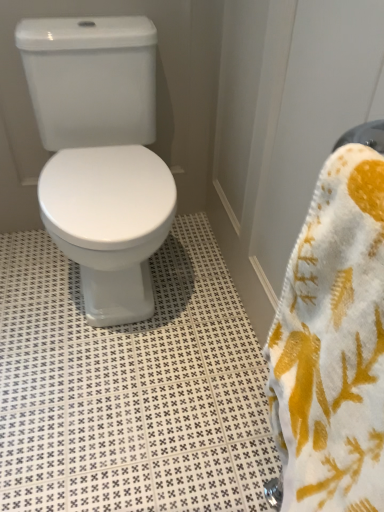
Question: Can you see white textured tile at center touching white soft towel at right?

Choices:
 (A) no
 (B) yes

Answer: (A)

Question: Can you confirm if white textured tile at center is thinner than white soft towel at right?

Choices:
 (A) yes
 (B) no

Answer: (B)

Question: Is white textured tile at center facing away from white soft towel at right?

Choices:
 (A) yes
 (B) no

Answer: (B)

Question: Does white textured tile at center turn towards white soft towel at right?

Choices:
 (A) yes
 (B) no

Answer: (B)

Question: Is white textured tile at center wider than white soft towel at right?

Choices:
 (A) no
 (B) yes

Answer: (B)

Question: Does white textured tile at center have a smaller size compared to white soft towel at right?

Choices:
 (A) yes
 (B) no

Answer: (B)

Question: Can you confirm if white glossy toilet at center is positioned to the right of white textured tile at center?

Choices:
 (A) no
 (B) yes

Answer: (A)

Question: Considering the relative sizes of white glossy toilet at center and white textured tile at center in the image provided, is white glossy toilet at center shorter than white textured tile at center?

Choices:
 (A) yes
 (B) no

Answer: (B)

Question: Is white glossy toilet at center looking in the opposite direction of white textured tile at center?

Choices:
 (A) no
 (B) yes

Answer: (A)

Question: From the image's perspective, would you say white glossy toilet at center is positioned over white textured tile at center?

Choices:
 (A) no
 (B) yes

Answer: (B)

Question: Can you confirm if white glossy toilet at center is positioned to the left of white textured tile at center?

Choices:
 (A) no
 (B) yes

Answer: (B)

Question: Is white textured tile at center completely or partially inside white glossy toilet at center?

Choices:
 (A) yes
 (B) no

Answer: (B)

Question: Is white glossy toilet at center surrounding white soft towel at right?

Choices:
 (A) no
 (B) yes

Answer: (A)